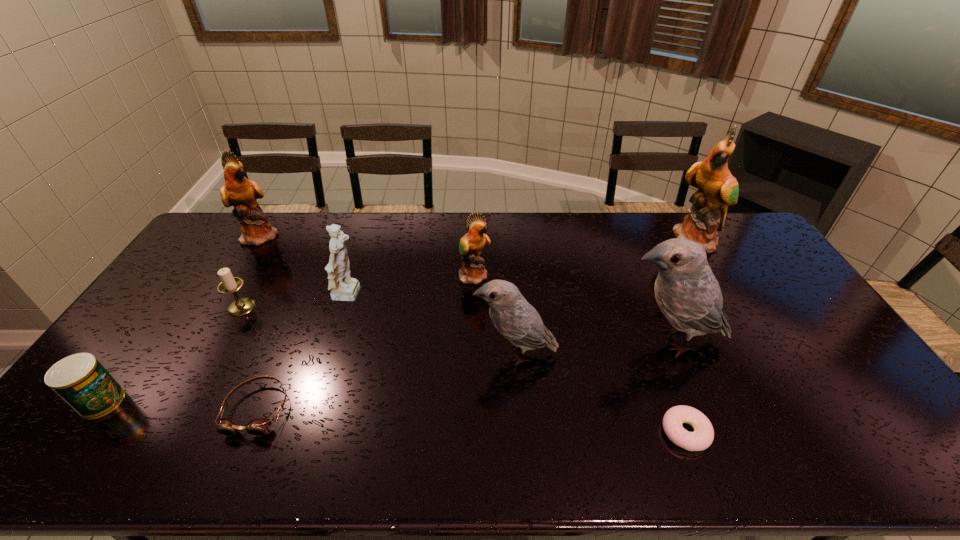
The width and height of the screenshot is (960, 540). I want to click on vacant region between the figurine and the leftmost green parrot, so click(x=305, y=266).

Point out which object is positioned as the third nearest to the left gray parrot. Please provide its 2D coordinates. Your answer should be formatted as a tuple, i.e. [(x, y)], where the tuple contains the x and y coordinates of a point satisfying the conditions above.

[(702, 437)]

Locate which object is the eighth closest to the pink doughnut. Please provide its 2D coordinates. Your answer should be formatted as a tuple, i.e. [(x, y)], where the tuple contains the x and y coordinates of a point satisfying the conditions above.

[(238, 191)]

Image resolution: width=960 pixels, height=540 pixels. I want to click on parrot that stands as the third closest to the smaller gray parrot, so click(x=717, y=188).

Where is `parrot identified as the third closest to the leftmost parrot`? This screenshot has height=540, width=960. parrot identified as the third closest to the leftmost parrot is located at coordinates (687, 292).

Choose which green parrot is the nearest neighbor to the pink doughnut. Please provide its 2D coordinates. Your answer should be formatted as a tuple, i.e. [(x, y)], where the tuple contains the x and y coordinates of a point satisfying the conditions above.

[(473, 271)]

Image resolution: width=960 pixels, height=540 pixels. I want to click on green parrot that can be found as the second closest to the pink doughnut, so click(x=717, y=188).

Identify the location of blank area in the image that satisfies the following two spatial constraints: 1. on the back side of the doughnut; 2. on the front-facing side of the figurine. (636, 296).

Locate an element on the screen. This screenshot has width=960, height=540. free space that satisfies the following two spatial constraints: 1. on the front-facing side of the figurine; 2. on the right side of the pink doughnut is located at coordinates (307, 432).